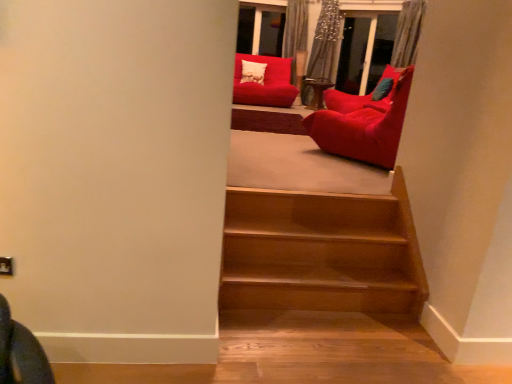
Question: In which direction should I rotate to look at matte red beanbag at upper center, the 2th chair viewed from the right?

Choices:
 (A) left
 (B) right

Answer: (A)

Question: Considering the relative sizes of velvet red bean bag at upper right, arranged as the second chair when viewed from the top, and matte red beanbag at upper center, the 2th chair viewed from the front, in the image provided, is velvet red bean bag at upper right, arranged as the second chair when viewed from the top, wider than matte red beanbag at upper center, the 2th chair viewed from the front,?

Choices:
 (A) yes
 (B) no

Answer: (B)

Question: Is velvet red bean bag at upper right, placed as the first chair when sorted from right to left, facing towards matte red beanbag at upper center, the 2th chair viewed from the front?

Choices:
 (A) yes
 (B) no

Answer: (A)

Question: Is velvet red bean bag at upper right, placed as the first chair when sorted from right to left, located outside matte red beanbag at upper center, the 2th chair viewed from the front?

Choices:
 (A) yes
 (B) no

Answer: (A)

Question: Can you confirm if velvet red bean bag at upper right, positioned as the 1th chair in bottom-to-top order, is thinner than matte red beanbag at upper center, the 1th chair when ordered from back to front?

Choices:
 (A) yes
 (B) no

Answer: (A)

Question: Is velvet red bean bag at upper right, placed as the first chair when sorted from right to left, placed right next to matte red beanbag at upper center, the 1th chair when ordered from back to front?

Choices:
 (A) yes
 (B) no

Answer: (B)

Question: Does velvet red bean bag at upper right, placed as the first chair when sorted from right to left, have a smaller size compared to matte red beanbag at upper center, which is the 2th chair in bottom-to-top order?

Choices:
 (A) yes
 (B) no

Answer: (A)

Question: From the image's perspective, would you say matte red beanbag at upper center, the 1th chair when ordered from back to front, is shown under velvet red bean bag at upper right, arranged as the second chair when viewed from the top?

Choices:
 (A) no
 (B) yes

Answer: (A)

Question: Considering the relative positions of matte red beanbag at upper center, the 1th chair when ordered from back to front, and velvet red bean bag at upper right, which is the 1th chair from front to back, in the image provided, is matte red beanbag at upper center, the 1th chair when ordered from back to front, behind velvet red bean bag at upper right, which is the 1th chair from front to back,?

Choices:
 (A) no
 (B) yes

Answer: (B)

Question: Considering the relative sizes of matte red beanbag at upper center, the first chair when ordered from top to bottom, and velvet red bean bag at upper right, which is counted as the second chair, starting from the back, in the image provided, is matte red beanbag at upper center, the first chair when ordered from top to bottom, thinner than velvet red bean bag at upper right, which is counted as the second chair, starting from the back,?

Choices:
 (A) no
 (B) yes

Answer: (A)

Question: Is matte red beanbag at upper center, the 1th chair when ordered from back to front, at the left side of velvet red bean bag at upper right, placed as the first chair when sorted from right to left?

Choices:
 (A) no
 (B) yes

Answer: (B)

Question: Is matte red beanbag at upper center, marked as the 1th chair in a left-to-right arrangement, taller than velvet red bean bag at upper right, positioned as the 1th chair in bottom-to-top order?

Choices:
 (A) yes
 (B) no

Answer: (B)

Question: Considering the relative positions of matte red beanbag at upper center, the 2th chair viewed from the front, and velvet red bean bag at upper right, arranged as the second chair when viewed from the top, in the image provided, is matte red beanbag at upper center, the 2th chair viewed from the front, in front of velvet red bean bag at upper right, arranged as the second chair when viewed from the top,?

Choices:
 (A) no
 (B) yes

Answer: (A)

Question: From a real-world perspective, is matte red beanbag at upper center, the 1th chair when ordered from back to front, physically located above or below velvet red bean bag at upper right, which is the 1th chair from front to back?

Choices:
 (A) below
 (B) above

Answer: (A)